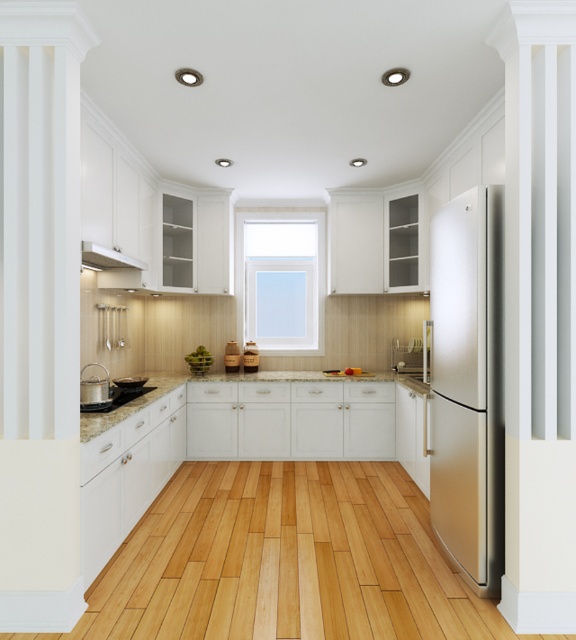
You are a delivery person who needs to place a new microwave oven that measures 1.5 meters in length between the satin stainless steel refrigerator at right and the brushed metal sink at lower left. Can the microwave fit in the space between them?

The satin stainless steel refrigerator at right is 1.86 meters away from the brushed metal sink at lower left. Since the microwave is 1.5 meters long, it can fit in the space between them as the distance is greater than the microwave length.

You are a kitchen designer planning to install a new appliance. You have a space that can only accommodate appliances no thicker than the brushed metal sink at lower left. Can the satin stainless steel refrigerator at right fit in that space?

The satin stainless steel refrigerator at right is thinner than the brushed metal sink at lower left, so it can fit in the space.